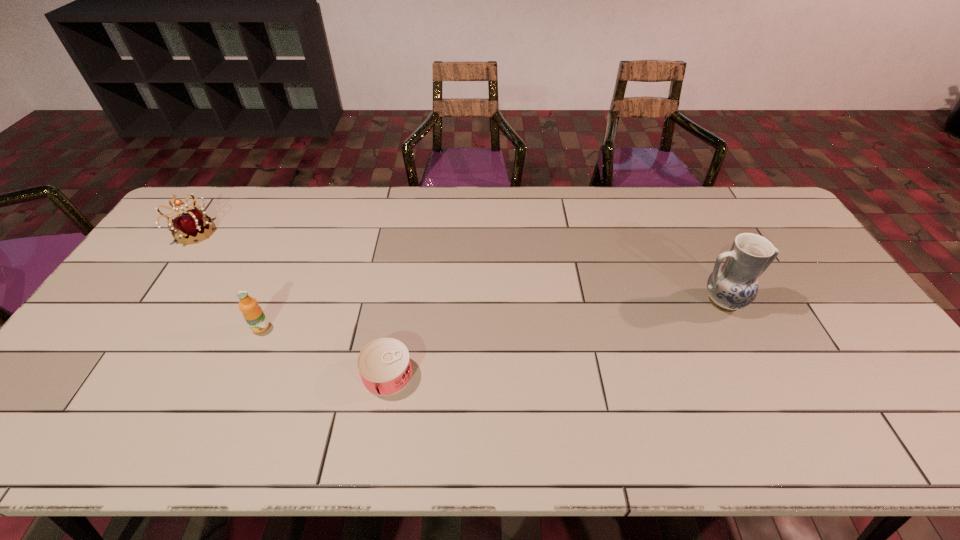
I want to click on blank space located 0.130m on the label of the third farthest object, so click(x=239, y=377).

At what (x,y) coordinates should I click in order to perform the action: click on vacant space located on the left of the second object from right to left. Please return your answer as a coordinate pair (x, y). This screenshot has height=540, width=960. Looking at the image, I should click on (338, 374).

At what (x,y) coordinates should I click in order to perform the action: click on object that is at the far edge. Please return your answer as a coordinate pair (x, y). This screenshot has height=540, width=960. Looking at the image, I should click on (192, 226).

I want to click on object at the left edge, so click(192, 226).

This screenshot has width=960, height=540. I want to click on object situated at the far left corner, so click(192, 226).

This screenshot has width=960, height=540. I want to click on free space at the far edge, so click(x=661, y=219).

At what (x,y) coordinates should I click in order to perform the action: click on vacant space at the near edge. Please return your answer as a coordinate pair (x, y). Image resolution: width=960 pixels, height=540 pixels. Looking at the image, I should click on (678, 428).

In the image, there is a desktop. At what (x,y) coordinates should I click in order to perform the action: click on vacant space at the left edge. Please return your answer as a coordinate pair (x, y). Image resolution: width=960 pixels, height=540 pixels. Looking at the image, I should click on (182, 258).

This screenshot has width=960, height=540. What are the coordinates of `free spot at the right edge of the desktop` in the screenshot? It's located at (806, 276).

Identify the location of free space at the far right corner of the desktop. This screenshot has width=960, height=540. pos(781,225).